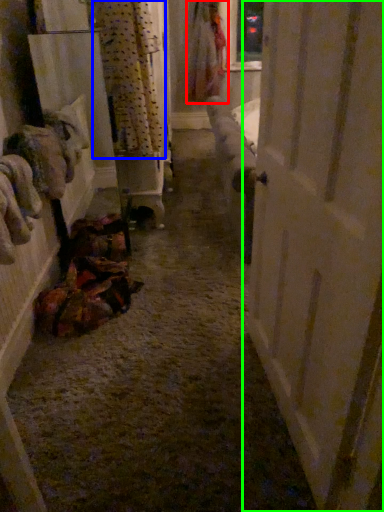
Question: Considering the real-world distances, which object is farthest from clothing (highlighted by a red box)? curtain (highlighted by a blue box) or door (highlighted by a green box)?

Choices:
 (A) curtain
 (B) door

Answer: (B)